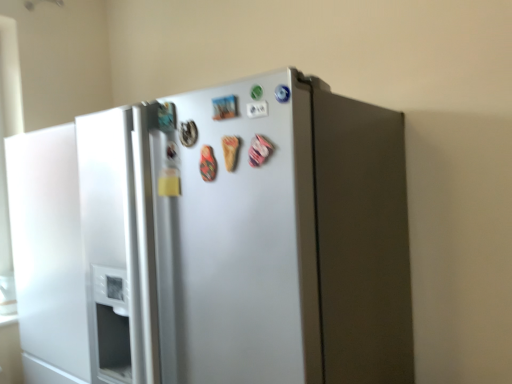
Question: Is satin silver refrigerator at center a part of white matte refrigerator door at left?

Choices:
 (A) no
 (B) yes

Answer: (A)

Question: From a real-world perspective, does white matte refrigerator door at left sit lower than satin silver refrigerator at center?

Choices:
 (A) yes
 (B) no

Answer: (A)

Question: Is white matte refrigerator door at left located outside satin silver refrigerator at center?

Choices:
 (A) no
 (B) yes

Answer: (B)

Question: Can you confirm if white matte refrigerator door at left is wider than satin silver refrigerator at center?

Choices:
 (A) no
 (B) yes

Answer: (A)

Question: Is white matte refrigerator door at left directly adjacent to satin silver refrigerator at center?

Choices:
 (A) no
 (B) yes

Answer: (A)

Question: Is there a large distance between white matte refrigerator door at left and satin silver refrigerator at center?

Choices:
 (A) yes
 (B) no

Answer: (B)

Question: From the image's perspective, is satin silver refrigerator at center located above white matte refrigerator door at left?

Choices:
 (A) no
 (B) yes

Answer: (B)

Question: Is satin silver refrigerator at center to the left of white matte refrigerator door at left from the viewer's perspective?

Choices:
 (A) no
 (B) yes

Answer: (A)

Question: From a real-world perspective, is satin silver refrigerator at center over white matte refrigerator door at left?

Choices:
 (A) yes
 (B) no

Answer: (A)

Question: Is satin silver refrigerator at center wider than white matte refrigerator door at left?

Choices:
 (A) yes
 (B) no

Answer: (A)

Question: Considering the relative sizes of satin silver refrigerator at center and white matte refrigerator door at left in the image provided, is satin silver refrigerator at center shorter than white matte refrigerator door at left?

Choices:
 (A) no
 (B) yes

Answer: (A)

Question: Is white matte refrigerator door at left completely or partially inside satin silver refrigerator at center?

Choices:
 (A) no
 (B) yes

Answer: (A)

Question: In the image, is satin silver refrigerator at center on the left side or the right side of white matte refrigerator door at left?

Choices:
 (A) left
 (B) right

Answer: (B)